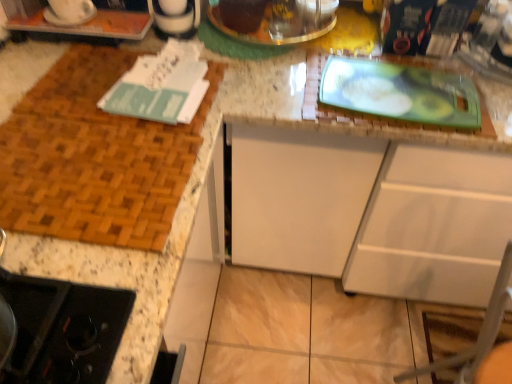
You are a GUI agent. You are given a task and a screenshot of the screen. Output one action in this format:
    pyautogui.click(x=<x>, y=<y>)
    Task: Click on the vacant region in front of metallic silver pot at upper center, arranged as the second appliance when viewed from the left
    Image resolution: width=512 pixels, height=384 pixels.
    Given the screenshot: What is the action you would take?
    (x=264, y=81)